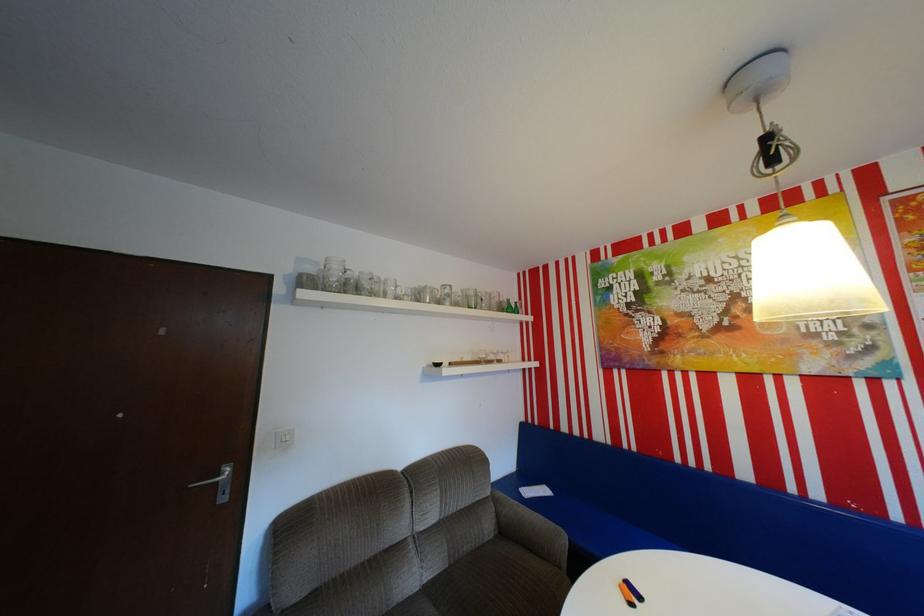
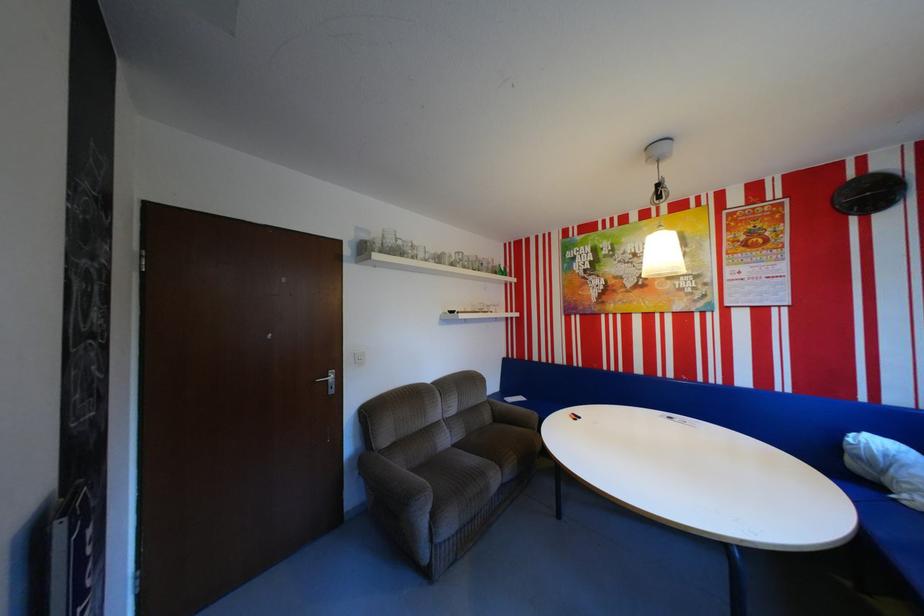
Looking at this image, in a continuous first-person perspective shot, in which direction is the camera moving?

The movement direction of the cameraman is left, backward.